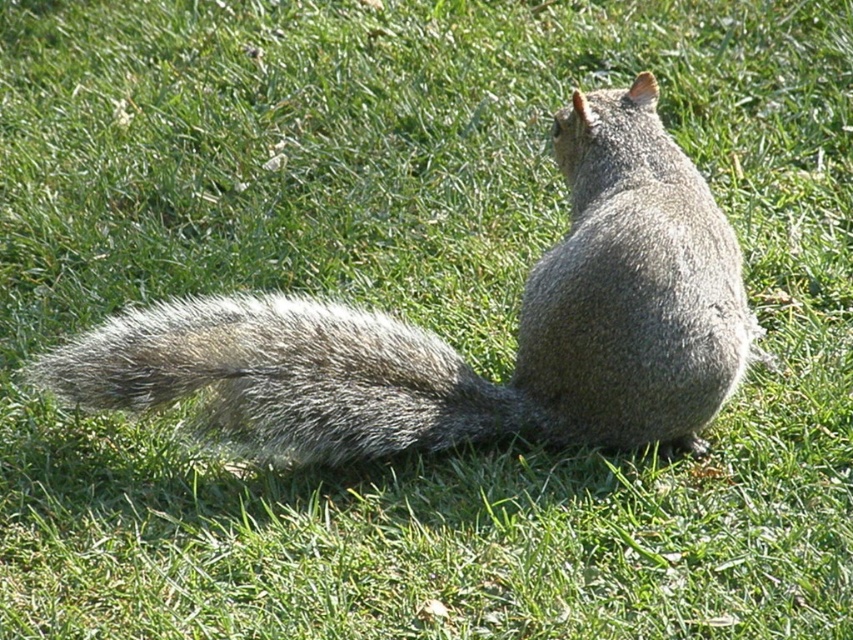
Who is shorter, gray furry squirrel at center or fuzzy gray tail at lower left?

With less height is fuzzy gray tail at lower left.

Does point (585, 436) lie in front of point (361, 442)?

No, (585, 436) is further to viewer.

Locate an element on the screen. Image resolution: width=853 pixels, height=640 pixels. gray furry squirrel at center is located at coordinates (451, 348).